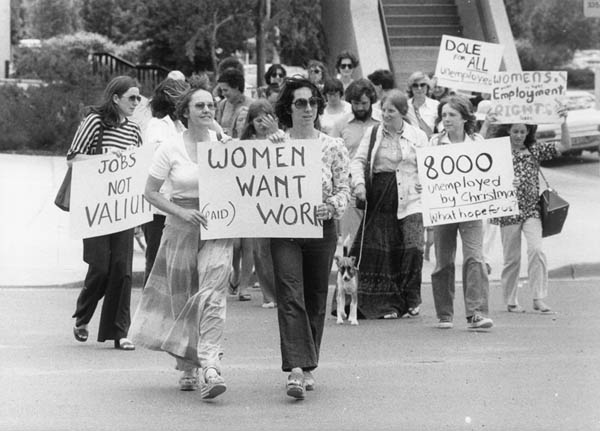
Locate an element on the screen. The height and width of the screenshot is (431, 600). grey cement stairs, top right is located at coordinates (409, 55), (416, 12).